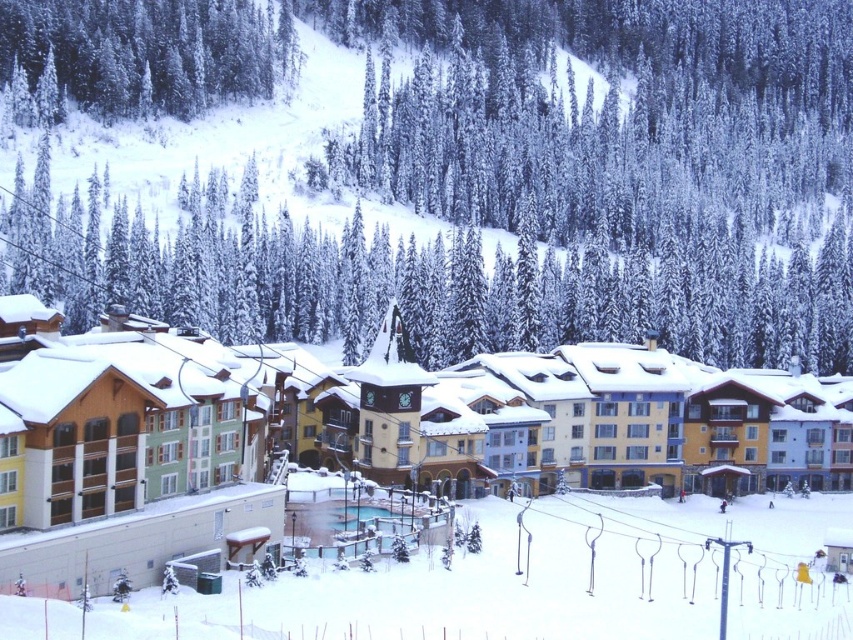
Question: Does snow-covered pine trees at center lie in front of snow-covered evergreen at upper left?

Choices:
 (A) yes
 (B) no

Answer: (A)

Question: Among these objects, which one is nearest to the camera?

Choices:
 (A) snow-covered evergreen at upper left
 (B) wooden ski resort at center

Answer: (B)

Question: In this image, where is wooden ski resort at center located relative to snow-covered evergreen at upper left?

Choices:
 (A) left
 (B) right

Answer: (B)

Question: Among these points, which one is farthest from the camera?

Choices:
 (A) (722, 467)
 (B) (49, 4)

Answer: (B)

Question: Based on their relative distances, which object is farther from the snow-covered evergreen at upper left?

Choices:
 (A) snow-covered pine trees at center
 (B) wooden ski resort at center

Answer: (B)

Question: Does wooden ski resort at center lie behind snow-covered evergreen at upper left?

Choices:
 (A) no
 (B) yes

Answer: (A)